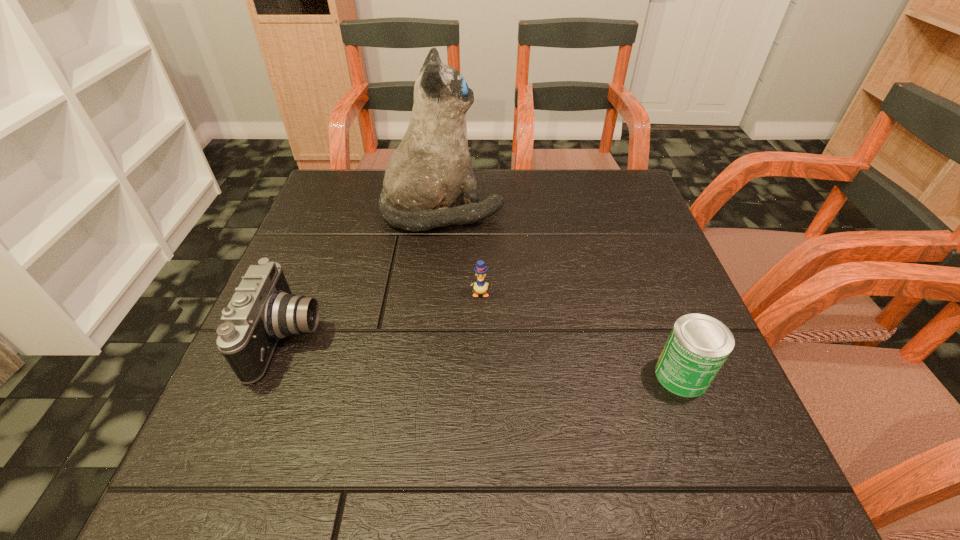
The image size is (960, 540). I want to click on vacant area that lies between the duckling and the second tallest object, so click(x=384, y=315).

Where is `object that is the third closest to the farthest object`? object that is the third closest to the farthest object is located at coordinates (698, 345).

Identify the location of object that is the third closest one to the farthest object. (698, 345).

The height and width of the screenshot is (540, 960). I want to click on vacant space that satisfies the following two spatial constraints: 1. on the face of the shortest object, where the monocle is placed; 2. on the left side of the can, so (480, 375).

Locate an element on the screen. vacant space that satisfies the following two spatial constraints: 1. at the face of the rightmost object; 2. on the left side of the tallest object is located at coordinates (426, 375).

I want to click on free location that satisfies the following two spatial constraints: 1. on the face of the duckling, where the monocle is placed; 2. on the right side of the can, so click(480, 375).

The height and width of the screenshot is (540, 960). I want to click on free point that satisfies the following two spatial constraints: 1. on the face of the duckling, where the monocle is placed; 2. on the front-facing side of the leftmost object, so click(480, 338).

Find the location of `vacant space that satisfies the following two spatial constraints: 1. on the back side of the third tallest object; 2. at the face of the tallest object`. vacant space that satisfies the following two spatial constraints: 1. on the back side of the third tallest object; 2. at the face of the tallest object is located at coordinates (619, 211).

The width and height of the screenshot is (960, 540). Find the location of `free space that satisfies the following two spatial constraints: 1. on the front-facing side of the third tallest object; 2. on the right side of the leftmost object`. free space that satisfies the following two spatial constraints: 1. on the front-facing side of the third tallest object; 2. on the right side of the leftmost object is located at coordinates (274, 375).

The image size is (960, 540). I want to click on blank space that satisfies the following two spatial constraints: 1. on the back side of the can; 2. on the front-facing side of the camera, so click(x=667, y=338).